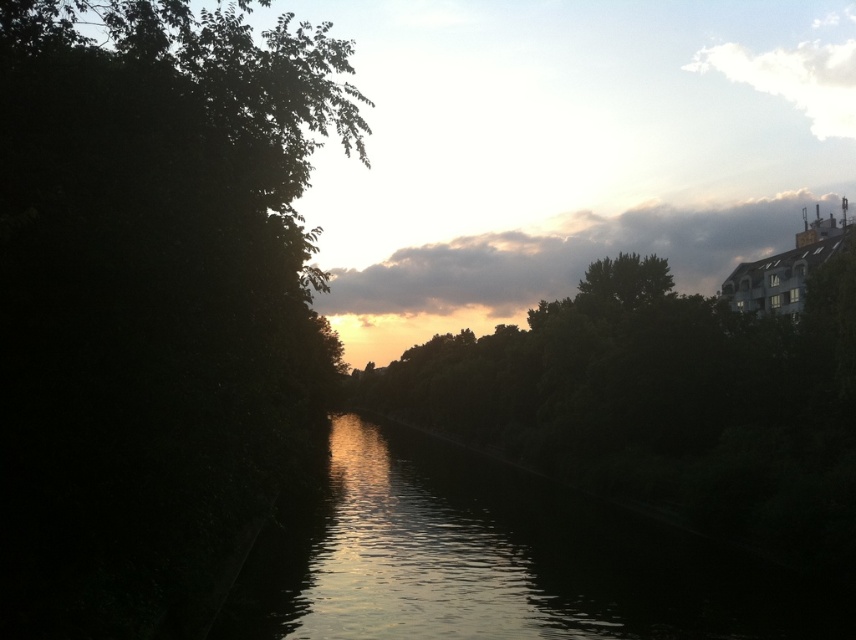
Does point (336, 65) come in front of point (491, 566)?

Yes, point (336, 65) is in front of point (491, 566).

Who is positioned more to the left, dark green leafy tree at left or silvery reflective water at center?

From the viewer's perspective, dark green leafy tree at left appears more on the left side.

Where is `dark green leafy tree at left`? Image resolution: width=856 pixels, height=640 pixels. dark green leafy tree at left is located at coordinates (153, 301).